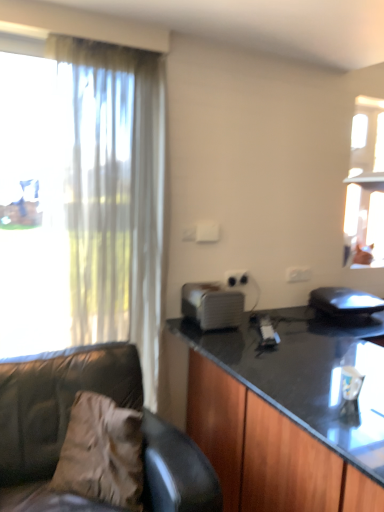
Question: Does black glossy cabinet at right have a smaller size compared to white plastic power outlet at center?

Choices:
 (A) no
 (B) yes

Answer: (A)

Question: Is black glossy cabinet at right at the left side of white plastic power outlet at center?

Choices:
 (A) no
 (B) yes

Answer: (A)

Question: From a real-world perspective, is black glossy cabinet at right located beneath white plastic power outlet at center?

Choices:
 (A) no
 (B) yes

Answer: (B)

Question: Is black glossy cabinet at right looking in the opposite direction of white plastic power outlet at center?

Choices:
 (A) no
 (B) yes

Answer: (A)

Question: Is white plastic power outlet at center surrounded by black glossy cabinet at right?

Choices:
 (A) no
 (B) yes

Answer: (A)

Question: Is black glossy cabinet at right situated inside white plastic toaster at center, positioned as the first appliance in left-to-right order, or outside?

Choices:
 (A) inside
 (B) outside

Answer: (B)

Question: In terms of width, does black glossy cabinet at right look wider or thinner when compared to white plastic toaster at center, positioned as the first appliance in left-to-right order?

Choices:
 (A) thin
 (B) wide

Answer: (B)

Question: Would you say black glossy cabinet at right is to the left or to the right of white plastic toaster at center, which appears as the second appliance when viewed from the right, in the picture?

Choices:
 (A) left
 (B) right

Answer: (B)

Question: From a real-world perspective, is black glossy cabinet at right positioned above or below white plastic toaster at center, which appears as the second appliance when viewed from the right?

Choices:
 (A) above
 (B) below

Answer: (B)

Question: From the image's perspective, relative to leather couch at left, is white plastic toaster at center, which appears as the second appliance when viewed from the right, above or below?

Choices:
 (A) above
 (B) below

Answer: (A)

Question: From a real-world perspective, is white plastic toaster at center, positioned as the first appliance in left-to-right order, physically located above or below leather couch at left?

Choices:
 (A) above
 (B) below

Answer: (A)

Question: Considering the positions of white plastic toaster at center, positioned as the first appliance in left-to-right order, and leather couch at left in the image, is white plastic toaster at center, positioned as the first appliance in left-to-right order, wider or thinner than leather couch at left?

Choices:
 (A) wide
 (B) thin

Answer: (B)

Question: Is point (188, 285) closer or farther from the camera than point (183, 501)?

Choices:
 (A) farther
 (B) closer

Answer: (A)

Question: Considering the positions of white plastic toaster at center, positioned as the first appliance in left-to-right order, and black plastic laptop at right, the first appliance positioned from the right, in the image, is white plastic toaster at center, positioned as the first appliance in left-to-right order, bigger or smaller than black plastic laptop at right, the first appliance positioned from the right,?

Choices:
 (A) small
 (B) big

Answer: (A)

Question: Choose the correct answer: Is white plastic toaster at center, which appears as the second appliance when viewed from the right, inside black plastic laptop at right, positioned as the second appliance in left-to-right order, or outside it?

Choices:
 (A) outside
 (B) inside

Answer: (A)